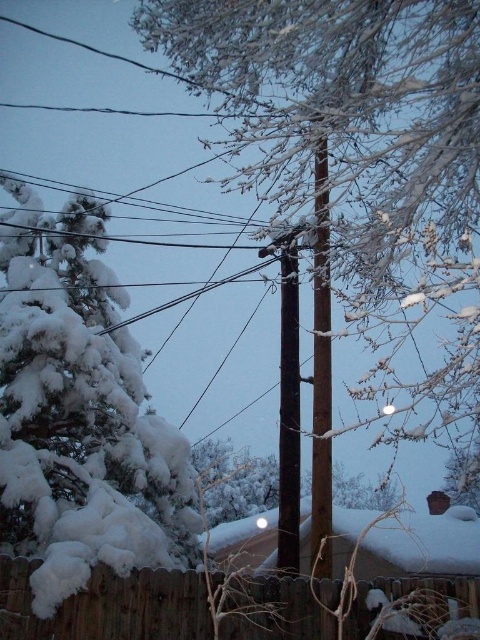
You are an artist planning to paint the winter scene. You need to decide which brown telegraph pole to focus on for the central part of your painting. Which one is bigger between the brown wood telegraph pole at center and the brown wooden telegraph pole at center?

The brown wood telegraph pole at center is larger in size than the brown wooden telegraph pole at center, so you should focus on the brown wood telegraph pole at center for the central part of your painting.

You are standing at the edge of the snow scene and want to take a photo of the wooden fence at lower center without the white fluffy tree at left blocking it. How should you position yourself?

Move to the right side of the white fluffy tree at left so that the wooden fence at lower center, which is behind the tree, becomes visible without obstruction.